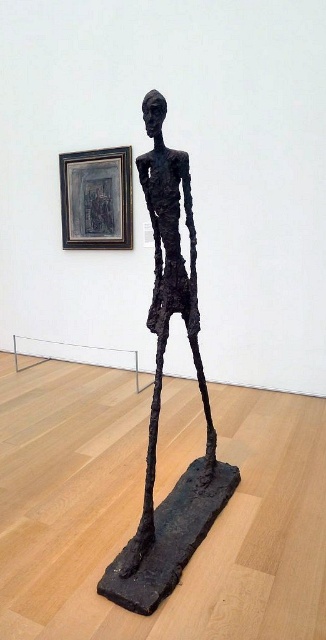
You are standing in the art gallery and want to take a photo of both the sculpture and the framed artwork. The sculpture is at point [123,580] and the framed artwork is at point [123,173]. Since you want both in the frame, will the sculpture block the view of the framed artwork?

Point [123,580] is in front of point [123,173], so the sculpture at point [123,580] will block the view of the framed artwork at point [123,173].

You are an art curator planning to move the matte black frame at upper left closer to the rusty metal figure at center. Based on their current positions, which object is currently farther from the entrance of the gallery?

The matte black frame at upper left is farther from the entrance because the rusty metal figure at center is positioned on the right side of it, implying it is closer to the entrance.